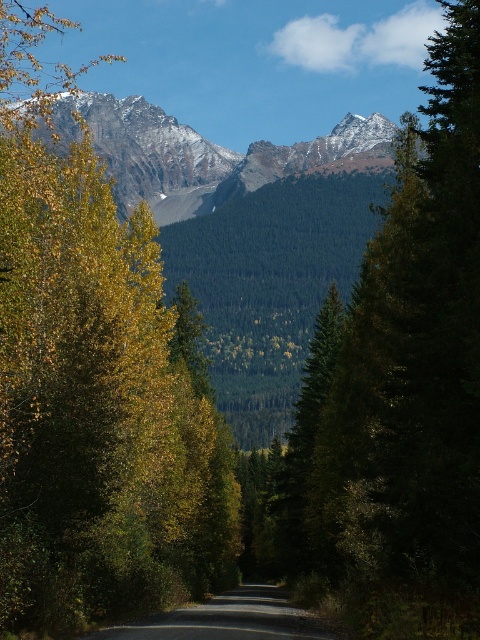
You are standing at the starting point of the road in the forest scene. There are two points marked on the road ahead of you. The first point is at coordinates point (107, 476) and the second is at point (271, 602). Which point is closer to your current position?

Point (107, 476) is in front of point (271, 602), so it is closer to your current position.